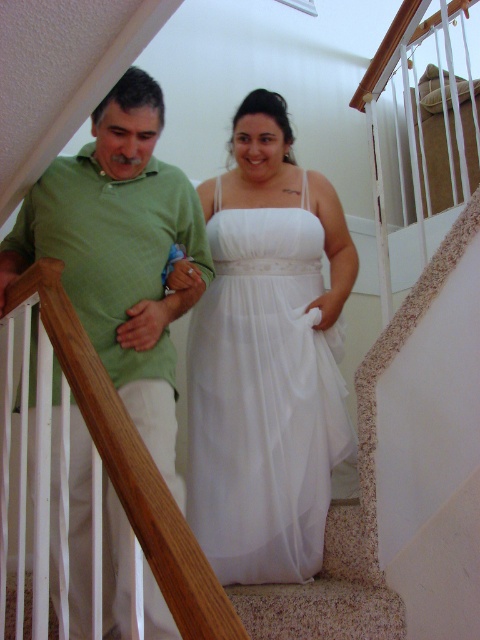
You are standing at the bottom of the staircase and want to place a small decorative item exactly halfway between the point at coordinates point (304, 262) and the point at coordinates point (175, 396). Will the decorative item be closer to the camera or further away from the camera compared to the average depth of the two points?

The decorative item placed halfway between the two points will be closer to the camera than the average depth of the two points because point (304, 262) is closer to the camera than point (175, 396). The average depth would be between the two depths, so the midpoint in space would actually be closer to the camera than the average of their distances.

You are a photographer positioned at the bottom of the staircase. You need to capture a photo of both the white chiffon dress at center and the green matte shirt at left. Based on their positions, which subject will appear closer to the top of the photo?

The white chiffon dress at center is located above the green matte shirt at left, so it will appear closer to the top of the photo.

You are a photographer positioned at the bottom of the staircase. You need to capture a photo of both the white chiffon dress at center and the green matte shirt at left without any obstruction. Based on their positions, which object should you focus on first to ensure both are in frame?

The white chiffon dress at center is positioned on the right side of green matte shirt at left. To ensure both are in frame, focus on the green matte shirt at left first as it is closer to the left side, allowing the camera to capture the entire scene from left to right.